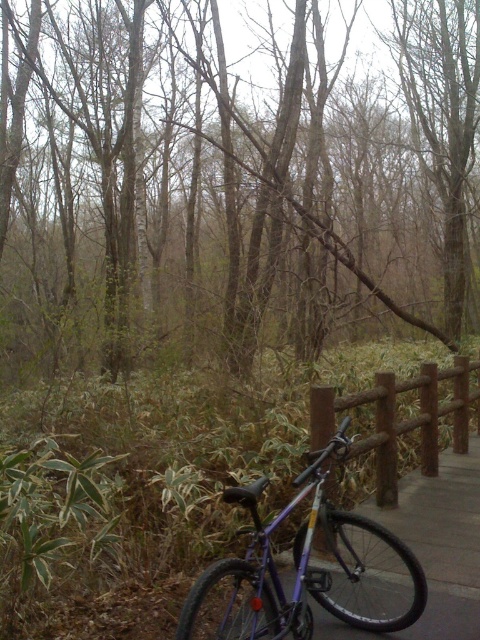
You are standing at the entrance of the forest path and want to reach a specific point marked as point (308, 632). Given that the path is 10 feet wide, can you walk directly to the point without stepping off the path?

The distance of point (308, 632) from viewer is 10.49 feet. Since the path is 10 feet wide, the point is slightly beyond the path width, so you would need to step off the path to reach it.

You are a hiker who wants to secure your purple matte mountain bike at center to the brown wooden rail at right. Given their positions, can you reach the rail from where the bike is currently leaning?

The purple matte mountain bike at center is to the left of the brown wooden rail at right, so yes, the hiker can easily reach the brown wooden rail at right from the bike to secure it.